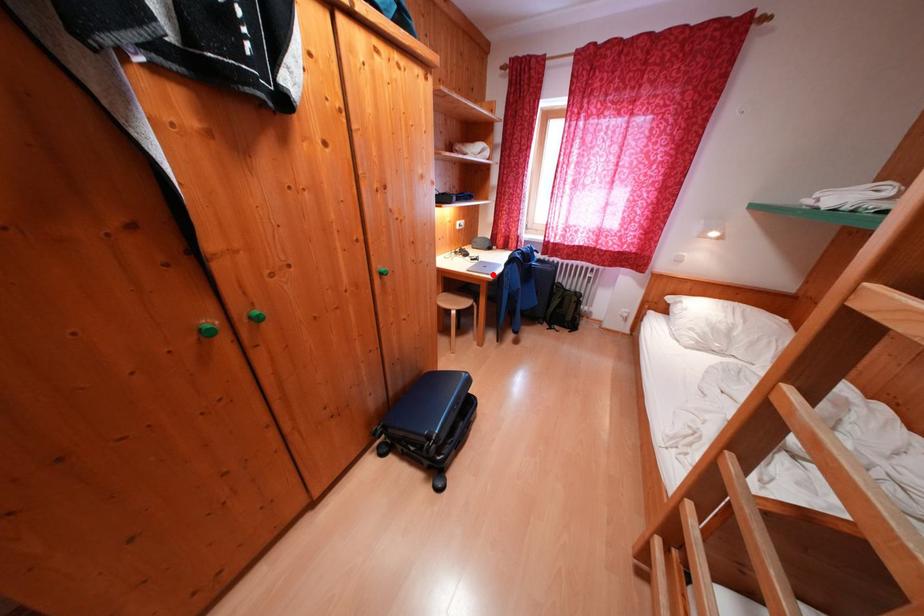
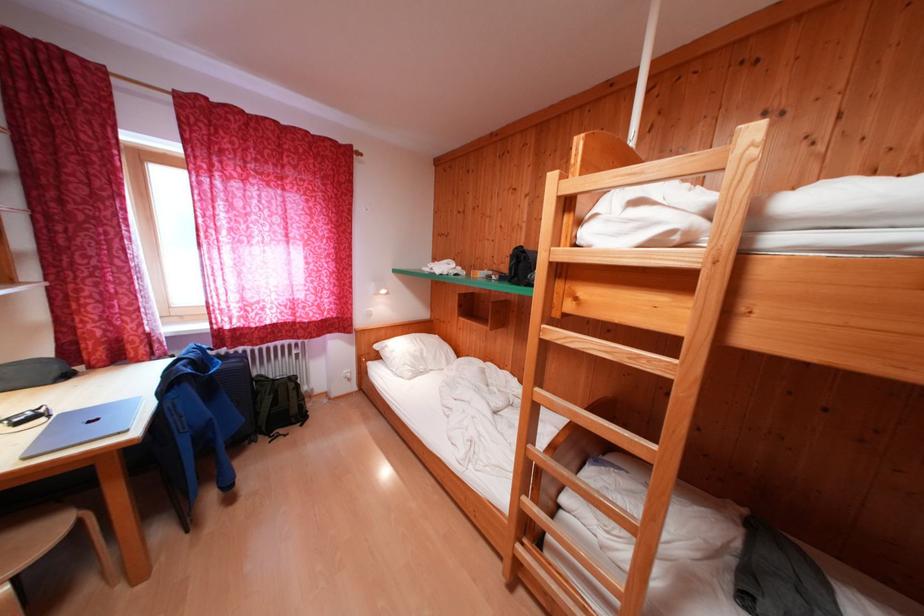
Question: I am providing you with two images of the same scene from different viewpoints. Image1 has a red point marked. In image2, the corresponding 3D location appears at what relative position? Reply with the corresponding letter.

Choices:
 (A) Closer
 (B) Farther

Answer: (B)